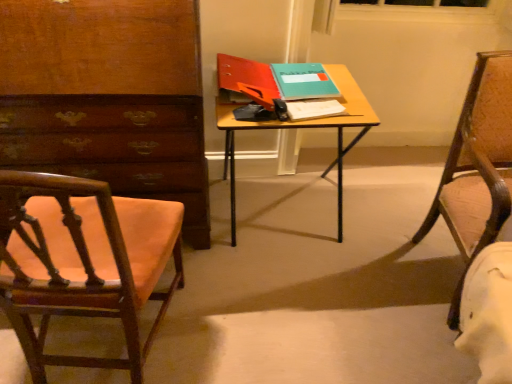
Where is `vacant area that is in front of wooden desk at center`? Image resolution: width=512 pixels, height=384 pixels. vacant area that is in front of wooden desk at center is located at coordinates point(287,306).